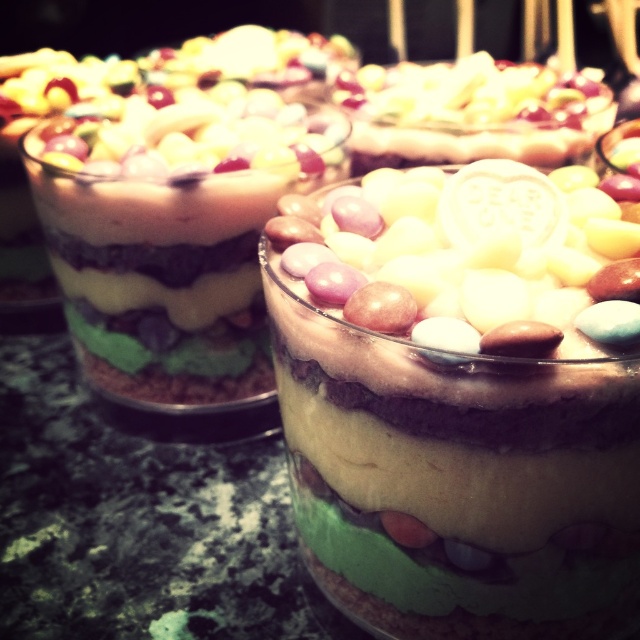
Question: Which point is farther to the camera?

Choices:
 (A) (589, 385)
 (B) (486, 252)

Answer: (B)

Question: Is smooth chocolate pudding at center below white matte heart-shaped candy at center?

Choices:
 (A) yes
 (B) no

Answer: (A)

Question: Does smooth chocolate pudding at center appear under white matte heart-shaped candy at center?

Choices:
 (A) yes
 (B) no

Answer: (A)

Question: Can you confirm if smooth chocolate pudding at center is smaller than white matte heart-shaped candy at center?

Choices:
 (A) yes
 (B) no

Answer: (B)